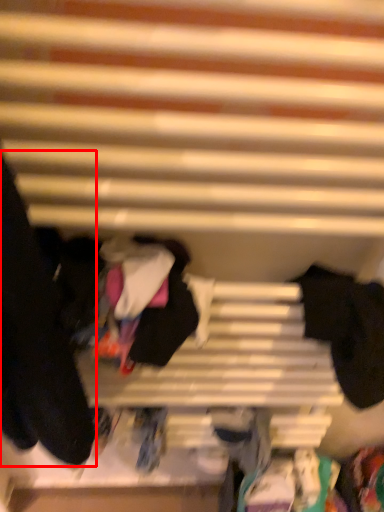
Question: From the image's perspective, what is the correct spatial relationship of clothing (annotated by the red box) in relation to clothing?

Choices:
 (A) below
 (B) above

Answer: (B)